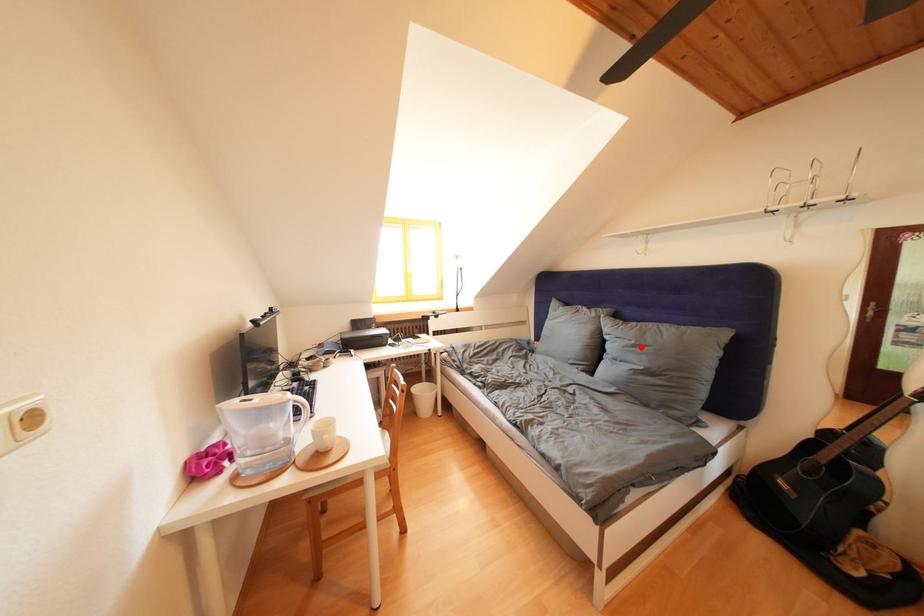
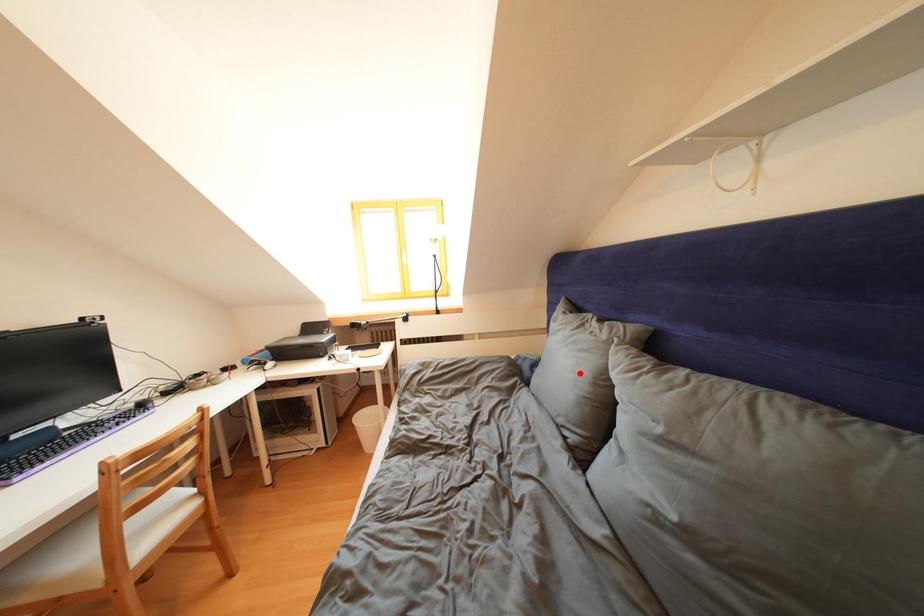
I am providing you with two images of the same scene from different viewpoints. A red point is marked on the first image and another point is marked on the second image. Do the highlighted points in image1 and image2 indicate the same real-world spot?

No